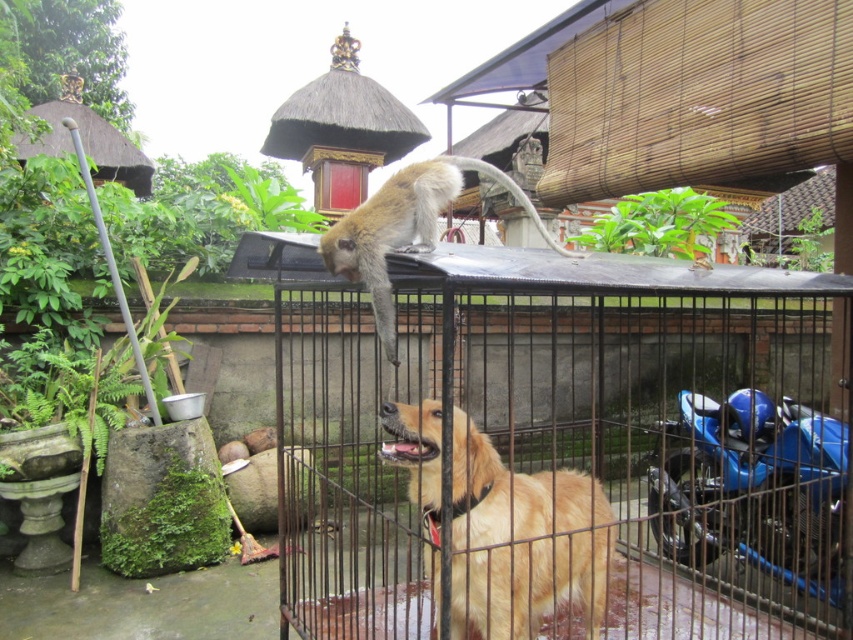
You are a photographer trying to capture a clear shot of the monkey and the dog in the cage. You notice two points marked in the scene. Which point, point [743,604] or point [366,244], is closer to your camera lens?

Point [743,604] is further to the viewer than point [366,244], so the point closer to your camera lens is point [366,244].

You are a zookeeper who needs to ensure the golden fur monkey at upper center can comfortably move around inside the black metal cage at center. Based on the scene description, is the cage wide enough for the monkey to move comfortably?

The black metal cage at center is narrower than the golden fur monkey at upper center, so it may not provide enough space for the monkey to move comfortably.

You are a photographer trying to capture the golden fur dog at center. Based on its coordinates, where should you aim your camera?

A: The golden fur dog at center is located at coordinates point (521, 541), so you should aim your camera at that position to capture it.